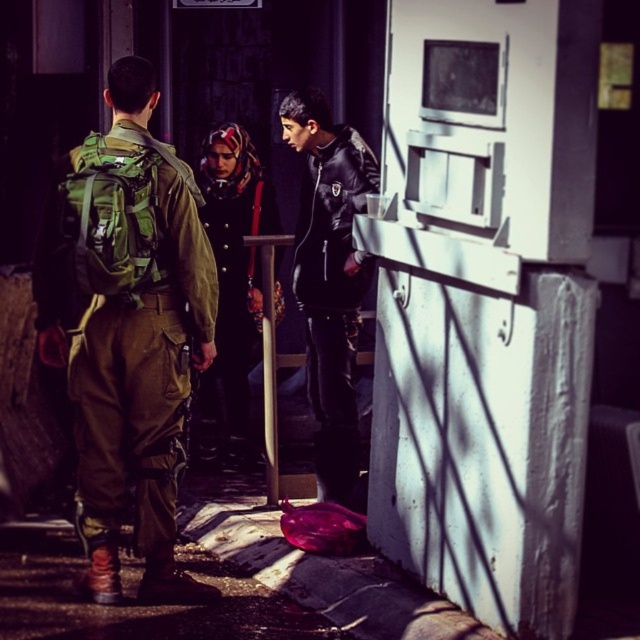
Question: Does black leather jacket at center come in front of matte black jacket at center?

Choices:
 (A) no
 (B) yes

Answer: (B)

Question: Observing the image, what is the correct spatial positioning of green military uniform at left in reference to matte black jacket at center?

Choices:
 (A) left
 (B) right

Answer: (A)

Question: Among these objects, which one is farthest from the camera?

Choices:
 (A) black leather jacket at center
 (B) green military uniform at left

Answer: (A)

Question: Is green military uniform at left positioned before black leather jacket at center?

Choices:
 (A) no
 (B) yes

Answer: (B)

Question: Which object is the closest to the matte black jacket at center?

Choices:
 (A) black leather jacket at center
 (B) green military uniform at left

Answer: (A)

Question: Which point is closer to the camera?

Choices:
 (A) matte black jacket at center
 (B) green military uniform at left
 (C) black leather jacket at center

Answer: (B)